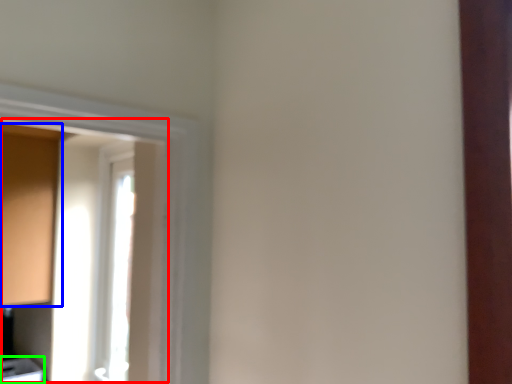
Question: Which object is the farthest from window screen (highlighted by a red box)? Choose among these: cabinetry (highlighted by a blue box) or cabinetry (highlighted by a green box).

Choices:
 (A) cabinetry
 (B) cabinetry

Answer: (B)